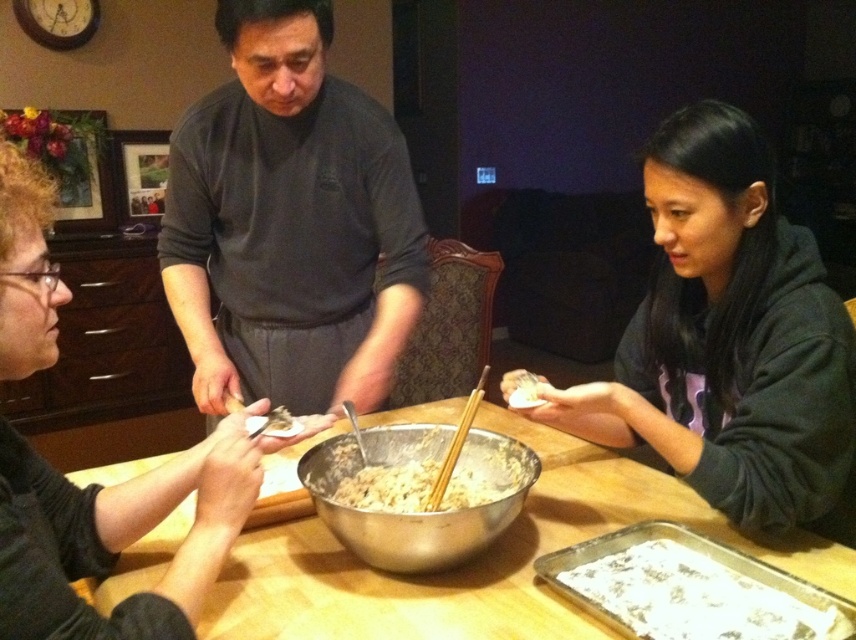
From the picture: You are a photographer standing at the end of the table. You want to take a photo of the curly hair person at left and the brown wooden chopsticks at center. Which object will appear larger in the photo?

The curly hair person at left will appear larger in the photo because they are taller than the brown wooden chopsticks at center.